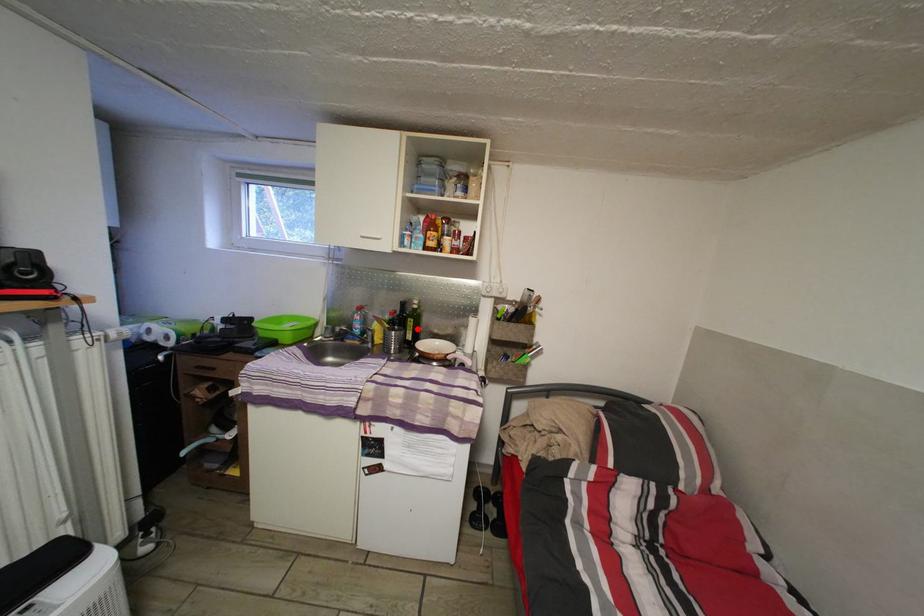
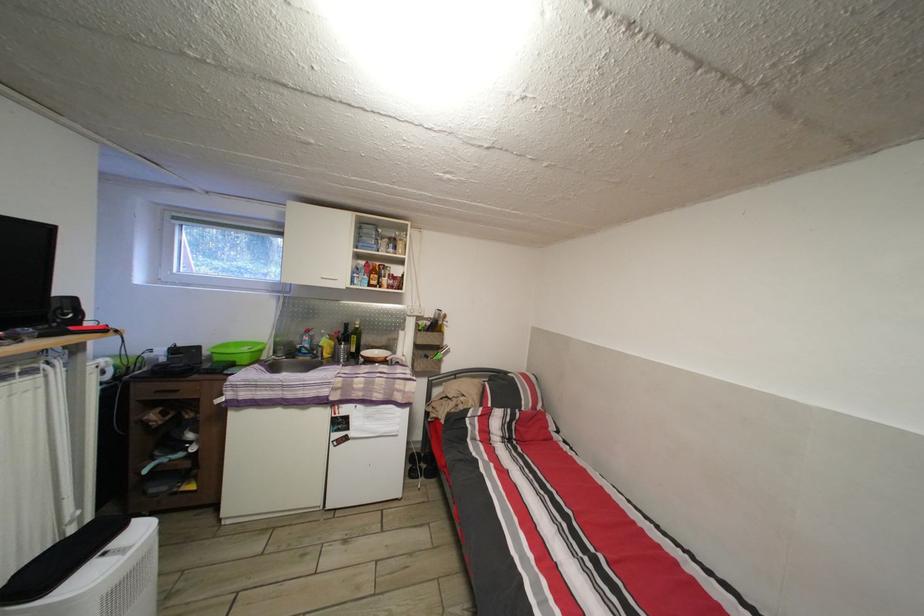
Question: I am providing you with two images of the same scene from different viewpoints. A red point is shown in image1. For the corresponding object point in image2, is it positioned nearer or farther from the camera?

Choices:
 (A) Nearer
 (B) Farther

Answer: (B)